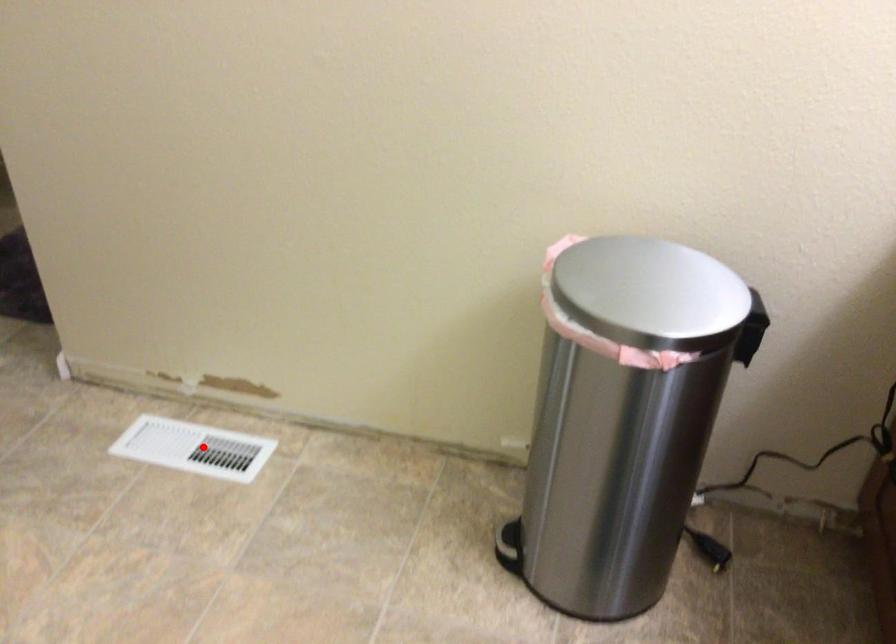
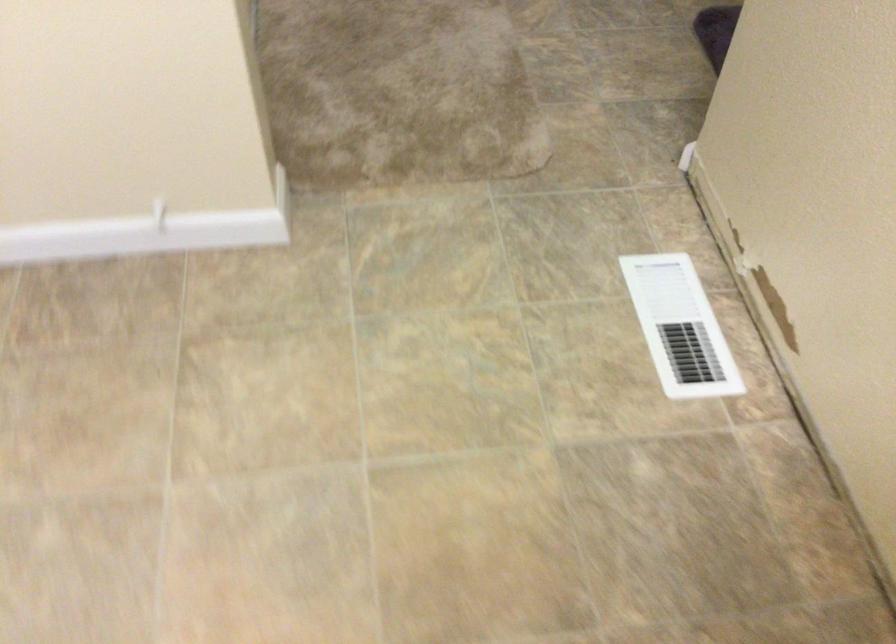
Question: A red point is marked in image1. In image2, is the corresponding 3D point closer to the camera or farther? Reply with the corresponding letter.

Choices:
 (A) The corresponding 3D point is closer.
 (B) The corresponding 3D point is farther.

Answer: (A)